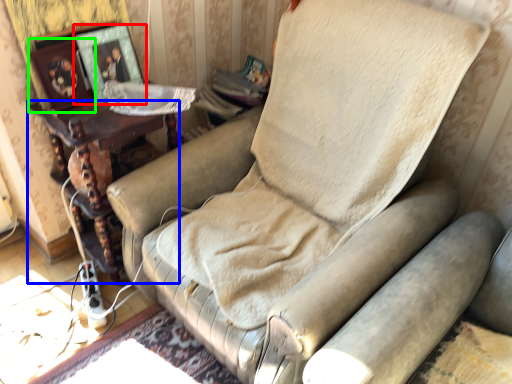
Question: Which object is positioned farthest from picture frame (highlighted by a red box)? Select from furniture (highlighted by a blue box) and picture frame (highlighted by a green box).

Choices:
 (A) furniture
 (B) picture frame

Answer: (A)